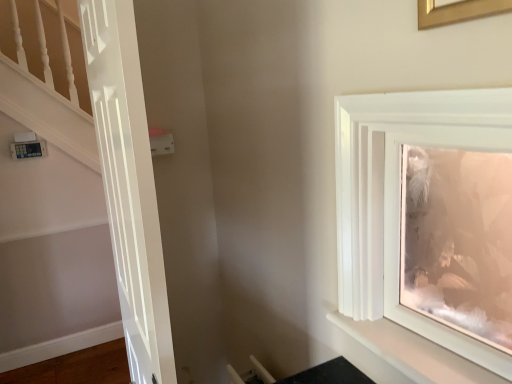
Locate an element on the screen. This screenshot has width=512, height=384. white glossy door at left is located at coordinates (128, 185).

From the picture: Is gold metallic picture frame at upper right, which is the first picture frame from front to back, not close to matte white picture frame at upper right, placed as the 2th picture frame when sorted from top to bottom?

That's right, there is a large distance between gold metallic picture frame at upper right, which is the first picture frame from front to back, and matte white picture frame at upper right, placed as the 2th picture frame when sorted from top to bottom.

Is gold metallic picture frame at upper right, which is the first picture frame from front to back, aimed at matte white picture frame at upper right, the first picture frame in the back-to-front sequence?

No, gold metallic picture frame at upper right, which is the first picture frame from front to back, is not turned towards matte white picture frame at upper right, the first picture frame in the back-to-front sequence.

Which is more to the right, gold metallic picture frame at upper right, which is the first picture frame from front to back, or matte white picture frame at upper right, the first picture frame in the back-to-front sequence?

matte white picture frame at upper right, the first picture frame in the back-to-front sequence, is more to the right.

Can matte white picture frame at upper right, the first picture frame in the back-to-front sequence, be found inside gold metallic picture frame at upper right, arranged as the 2th picture frame when viewed from the back?

No, matte white picture frame at upper right, the first picture frame in the back-to-front sequence, is not inside gold metallic picture frame at upper right, arranged as the 2th picture frame when viewed from the back.

Who is shorter, white glossy shelf at upper right or white plastic light switch at upper center?

white glossy shelf at upper right is shorter.

Considering the sizes of objects white glossy shelf at upper right and white plastic light switch at upper center in the image provided, who is bigger, white glossy shelf at upper right or white plastic light switch at upper center?

white glossy shelf at upper right.

Which object is closer to the camera, white glossy shelf at upper right or white plastic light switch at upper center?

Positioned in front is white glossy shelf at upper right.

Identify the location of light switch behind the white glossy shelf at upper right. (162, 144).

How different are the orientations of white glossy frame at upper right and gold metallic picture frame at upper right, which is the 1th picture frame from top to bottom, in degrees?

The facing directions of white glossy frame at upper right and gold metallic picture frame at upper right, which is the 1th picture frame from top to bottom, are 0.93 degrees apart.

Is point (341, 255) less distant than point (477, 0)?

No, it is behind (477, 0).

Is white glossy frame at upper right in front of or behind gold metallic picture frame at upper right, the 2th picture frame positioned from the bottom, in the image?

In the image, white glossy frame at upper right appears behind gold metallic picture frame at upper right, the 2th picture frame positioned from the bottom.

Is gold metallic picture frame at upper right, arranged as the 2th picture frame when viewed from the back, located within white glossy frame at upper right?

That's incorrect, gold metallic picture frame at upper right, arranged as the 2th picture frame when viewed from the back, is not inside white glossy frame at upper right.

How different are the orientations of white glossy frame at upper right and white plastic light switch at upper center in degrees?

90.5 degrees.

Is white glossy frame at upper right aimed at white plastic light switch at upper center?

No, white glossy frame at upper right is not facing towards white plastic light switch at upper center.

From a real-world perspective, is white glossy frame at upper right under white plastic light switch at upper center?

Indeed, from a real-world perspective, white glossy frame at upper right is positioned beneath white plastic light switch at upper center.

Is white glossy frame at upper right next to white plastic light switch at upper center?

No, white glossy frame at upper right is not beside white plastic light switch at upper center.

Is matte white picture frame at upper right, arranged as the first picture frame when ordered from the bottom, next to white glossy door at left and touching it?

matte white picture frame at upper right, arranged as the first picture frame when ordered from the bottom, and white glossy door at left are clearly separated.

Is matte white picture frame at upper right, the first picture frame in the back-to-front sequence, thinner than white glossy door at left?

Incorrect, the width of matte white picture frame at upper right, the first picture frame in the back-to-front sequence, is not less than that of white glossy door at left.

Does matte white picture frame at upper right, the second picture frame positioned from the front, appear on the left side of white glossy door at left?

In fact, matte white picture frame at upper right, the second picture frame positioned from the front, is to the right of white glossy door at left.

Considering the relative sizes of matte white picture frame at upper right, arranged as the first picture frame when ordered from the bottom, and white glossy door at left in the image provided, is matte white picture frame at upper right, arranged as the first picture frame when ordered from the bottom, bigger than white glossy door at left?

No.

Between white glossy door at left and matte white picture frame at upper right, arranged as the first picture frame when ordered from the bottom, which one has more height?

With more height is white glossy door at left.

Can you confirm if white glossy door at left is smaller than matte white picture frame at upper right, placed as the 2th picture frame when sorted from top to bottom?

No.

In terms of width, does white glossy door at left look wider or thinner when compared to matte white picture frame at upper right, the first picture frame in the back-to-front sequence?

white glossy door at left is thinner than matte white picture frame at upper right, the first picture frame in the back-to-front sequence.

From a real-world perspective, is white glossy door at left located higher than matte white picture frame at upper right, placed as the 2th picture frame when sorted from top to bottom?

Actually, white glossy door at left is physically below matte white picture frame at upper right, placed as the 2th picture frame when sorted from top to bottom, in the real world.

Which is closer to the camera, (133, 238) or (380, 208)?

Point (133, 238) is farther from the camera than point (380, 208).

In the scene shown: Considering the sizes of white glossy door at left and white glossy frame at upper right in the image, is white glossy door at left taller or shorter than white glossy frame at upper right?

In the image, white glossy door at left appears to be taller than white glossy frame at upper right.

Based on the photo, considering the sizes of objects white glossy door at left and white glossy frame at upper right in the image provided, who is smaller, white glossy door at left or white glossy frame at upper right?

With smaller size is white glossy frame at upper right.

The image size is (512, 384). In order to click on picture frame above the matte white picture frame at upper right, the second picture frame positioned from the front (from a real-world perspective) in this screenshot , I will do `click(458, 11)`.

Image resolution: width=512 pixels, height=384 pixels. Find the location of `light switch that is above the white glossy shelf at upper right (from the image's perspective)`. light switch that is above the white glossy shelf at upper right (from the image's perspective) is located at coordinates (162, 144).

Looking at the image, which one is located further to white plastic light switch at upper center, white glossy door at left or matte white picture frame at upper right, placed as the 2th picture frame when sorted from top to bottom?

matte white picture frame at upper right, placed as the 2th picture frame when sorted from top to bottom, is further to white plastic light switch at upper center.

Considering their positions, is white glossy shelf at upper right positioned further to white glossy frame at upper right than gold metallic picture frame at upper right, which is the first picture frame from front to back?

Based on the image, gold metallic picture frame at upper right, which is the first picture frame from front to back, appears to be further to white glossy frame at upper right.

Looking at the image, which one is located further to white glossy door at left, gold metallic picture frame at upper right, the 2th picture frame positioned from the bottom, or white glossy frame at upper right?

gold metallic picture frame at upper right, the 2th picture frame positioned from the bottom, lies further to white glossy door at left than the other object.

Based on their spatial positions, is white glossy shelf at upper right or white glossy frame at upper right closer to white glossy door at left?

The object closer to white glossy door at left is white glossy frame at upper right.

Estimate the real-world distances between objects in this image. Which object is closer to gold metallic picture frame at upper right, which is the first picture frame from front to back, matte white picture frame at upper right, the second picture frame positioned from the front, or white plastic light switch at upper center?

white plastic light switch at upper center lies closer to gold metallic picture frame at upper right, which is the first picture frame from front to back, than the other object.

When comparing their distances from white glossy door at left, does white plastic light switch at upper center or matte white picture frame at upper right, the second picture frame positioned from the front, seem closer?

Based on the image, white plastic light switch at upper center appears to be nearer to white glossy door at left.

Estimate the real-world distances between objects in this image. Which object is closer to gold metallic picture frame at upper right, arranged as the 2th picture frame when viewed from the back, white glossy shelf at upper right or white glossy frame at upper right?

white glossy frame at upper right.

When comparing their distances from white glossy shelf at upper right, does white glossy door at left or white plastic light switch at upper center seem closer?

Among the two, white glossy door at left is located nearer to white glossy shelf at upper right.

Locate an element on the screen. Image resolution: width=512 pixels, height=384 pixels. picture frame between gold metallic picture frame at upper right, which is the first picture frame from front to back, and white plastic light switch at upper center from front to back is located at coordinates (458, 239).

Locate an element on the screen. window situated between white glossy door at left and white glossy shelf at upper right from left to right is located at coordinates (399, 197).

The height and width of the screenshot is (384, 512). Identify the location of shelf located between white glossy door at left and matte white picture frame at upper right, the first picture frame in the back-to-front sequence, in the left-right direction. (410, 354).

Image resolution: width=512 pixels, height=384 pixels. Identify the location of door located between gold metallic picture frame at upper right, the 2th picture frame positioned from the bottom, and white plastic light switch at upper center in the depth direction. (128, 185).